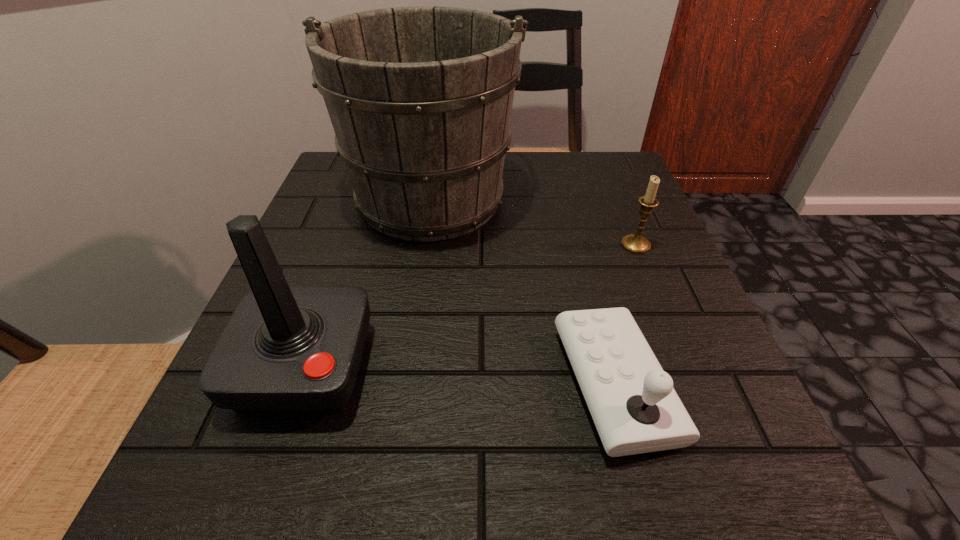
Locate an element on the screen. This screenshot has height=540, width=960. blank space at the left edge of the desktop is located at coordinates (347, 261).

The width and height of the screenshot is (960, 540). In the image, there is a desktop. In order to click on vacant space at the right edge in this screenshot , I will do `click(708, 370)`.

Identify the location of free space at the far left corner. This screenshot has width=960, height=540. [338, 161].

This screenshot has height=540, width=960. In order to click on free space at the near left corner of the desktop in this screenshot , I will do `click(296, 477)`.

In the image, there is a desktop. Identify the location of vacant space at the far right corner. The height and width of the screenshot is (540, 960). (617, 195).

The height and width of the screenshot is (540, 960). What are the coordinates of `free space between the third shortest object and the tallest object` in the screenshot? It's located at (368, 281).

Find the location of `vacant space that is in between the bucket and the taller joystick`. vacant space that is in between the bucket and the taller joystick is located at coordinates (368, 281).

You are a GUI agent. You are given a task and a screenshot of the screen. Output one action in this format:
    pyautogui.click(x=<x>, y=<y>)
    Task: Click on the vacant point located between the rightmost object and the bucket
    The width and height of the screenshot is (960, 540).
    Given the screenshot: What is the action you would take?
    coord(534,220)

Identify the location of empty space between the rightmost object and the tallest object. This screenshot has height=540, width=960. (534, 220).

In order to click on free spot between the rightmost object and the tallest object in this screenshot , I will do `click(534, 220)`.